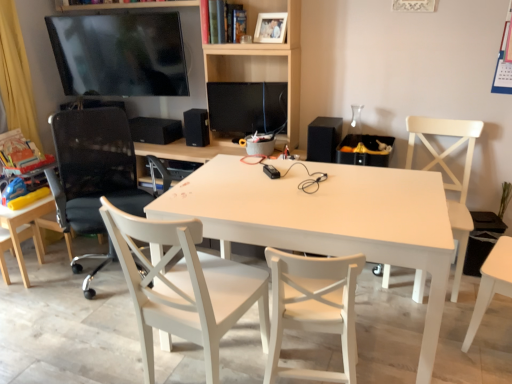
Identify the location of free space in front of black mesh office chair at left, marked as the 2th chair in a left-to-right arrangement. (74, 332).